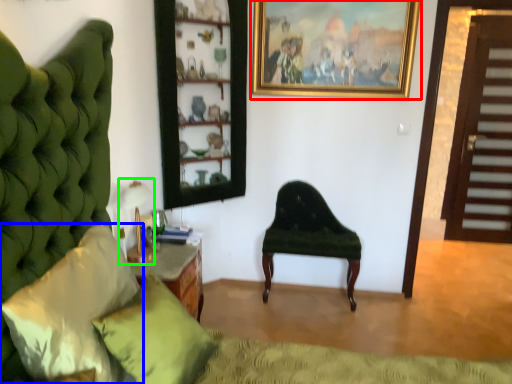
Question: Which object is positioned closest to picture frame (highlighted by a red box)? Select from pillow (highlighted by a blue box) and table lamp (highlighted by a green box).

Choices:
 (A) pillow
 (B) table lamp

Answer: (B)